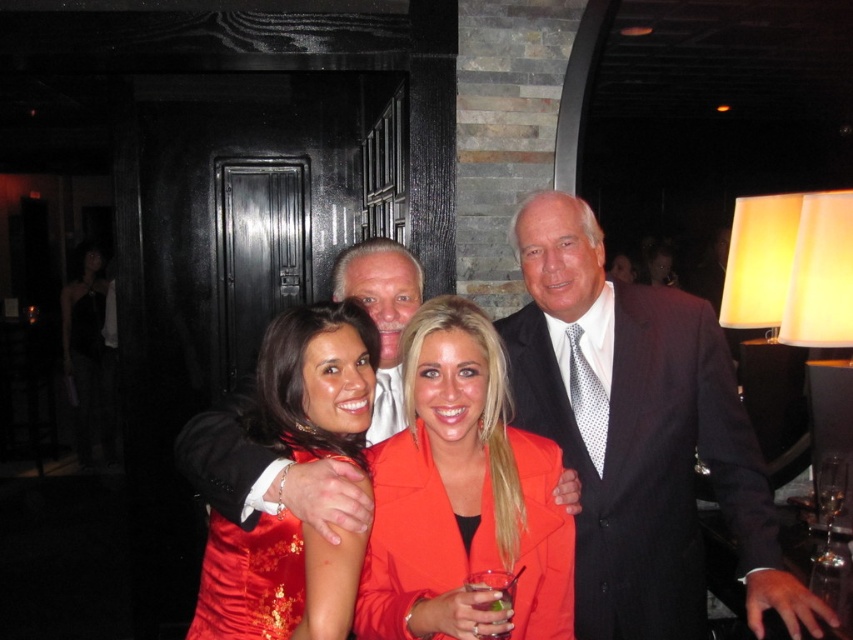
Question: Which object is positioned farthest from the clear plastic glass at center?

Choices:
 (A) orange satin jacket at center
 (B) dark suit at center

Answer: (B)

Question: Which object is farther from the camera taking this photo?

Choices:
 (A) dark suit at center
 (B) clear plastic glass at center
 (C) orange satin jacket at center
 (D) clear glass wine glass at lower right

Answer: (D)

Question: Can you confirm if dark suit at center is thinner than clear glass wine glass at lower right?

Choices:
 (A) yes
 (B) no

Answer: (B)

Question: Is dark suit at center above orange satin jacket at center?

Choices:
 (A) yes
 (B) no

Answer: (A)

Question: Can you confirm if satin red dress at center is positioned above clear glass wine glass at lower right?

Choices:
 (A) yes
 (B) no

Answer: (A)

Question: Which object is positioned closest to the dark suit at center?

Choices:
 (A) clear glass wine glass at lower right
 (B) orange satin jacket at center
 (C) clear plastic glass at center

Answer: (B)